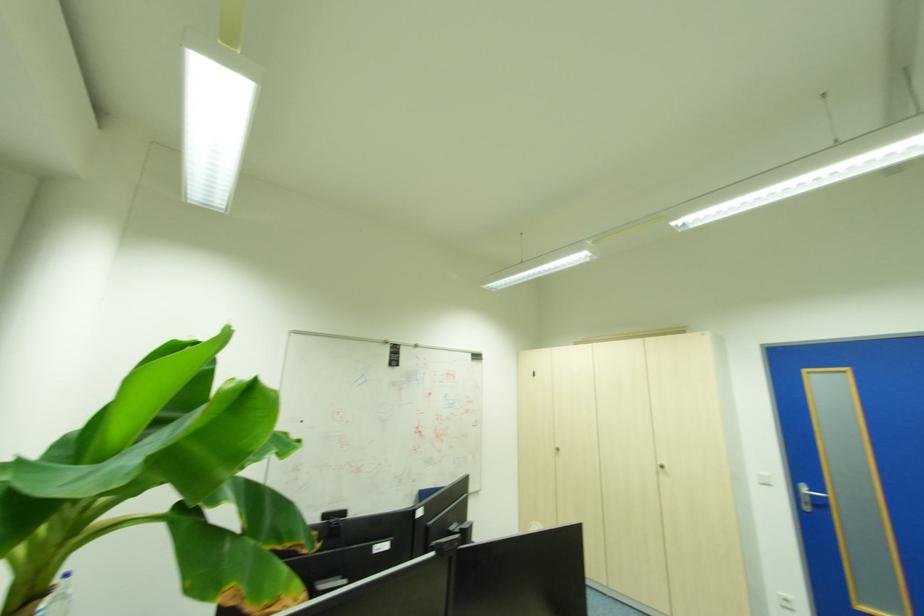
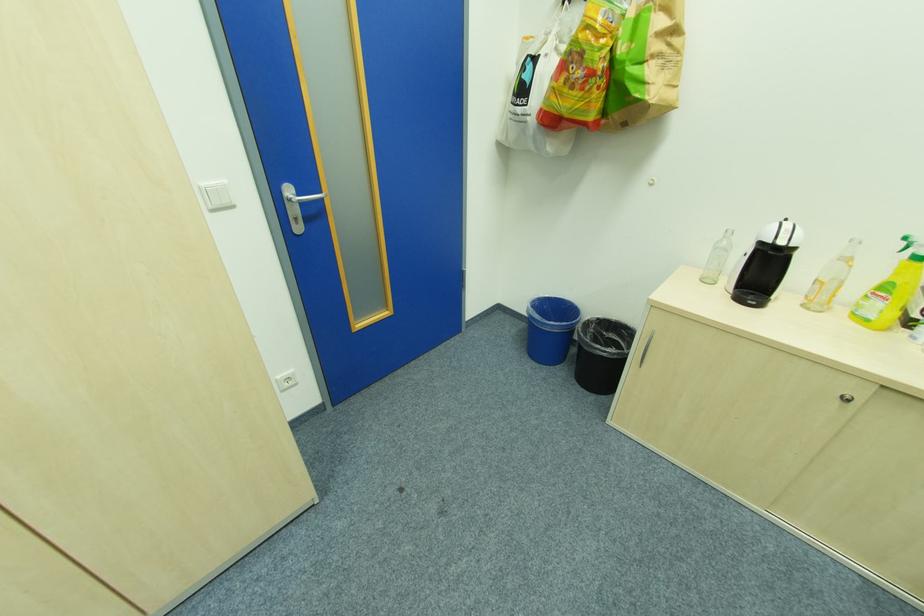
Find the pixel in the second image that matches point (772, 484) in the first image.

(232, 204)